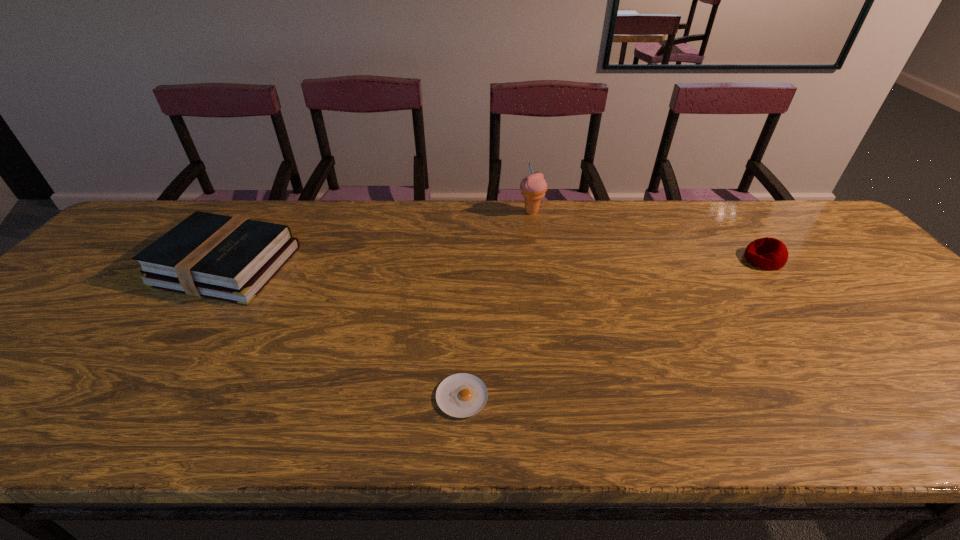
You are a GUI agent. You are given a task and a screenshot of the screen. Output one action in this format:
    pyautogui.click(x=<x>, y=<y>)
    Task: Click on the second object from right to left
    This screenshot has width=960, height=540.
    Given the screenshot: What is the action you would take?
    pyautogui.click(x=533, y=187)

You are a GUI agent. You are given a task and a screenshot of the screen. Output one action in this format:
    pyautogui.click(x=<x>, y=<y>)
    Task: Click on the icecream
    This screenshot has height=540, width=960.
    Given the screenshot: What is the action you would take?
    pyautogui.click(x=533, y=187)

Find the location of a particular element. the leftmost object is located at coordinates (221, 257).

Locate an element on the screen. The height and width of the screenshot is (540, 960). the third shortest object is located at coordinates pos(221,257).

This screenshot has width=960, height=540. In order to click on the rightmost object in this screenshot , I will do `click(767, 253)`.

You are a GUI agent. You are given a task and a screenshot of the screen. Output one action in this format:
    pyautogui.click(x=<x>, y=<y>)
    Task: Click on the beanbag
    
    Given the screenshot: What is the action you would take?
    pyautogui.click(x=767, y=253)

I want to click on the nearest object, so pyautogui.click(x=461, y=395).

Identify the location of the shortest object. Image resolution: width=960 pixels, height=540 pixels. (461, 395).

Where is `free space located on the left of the farthest object`? The height and width of the screenshot is (540, 960). free space located on the left of the farthest object is located at coordinates (474, 212).

This screenshot has width=960, height=540. What are the coordinates of `free space located 0.110m on the front of the hardback book` in the screenshot? It's located at (175, 340).